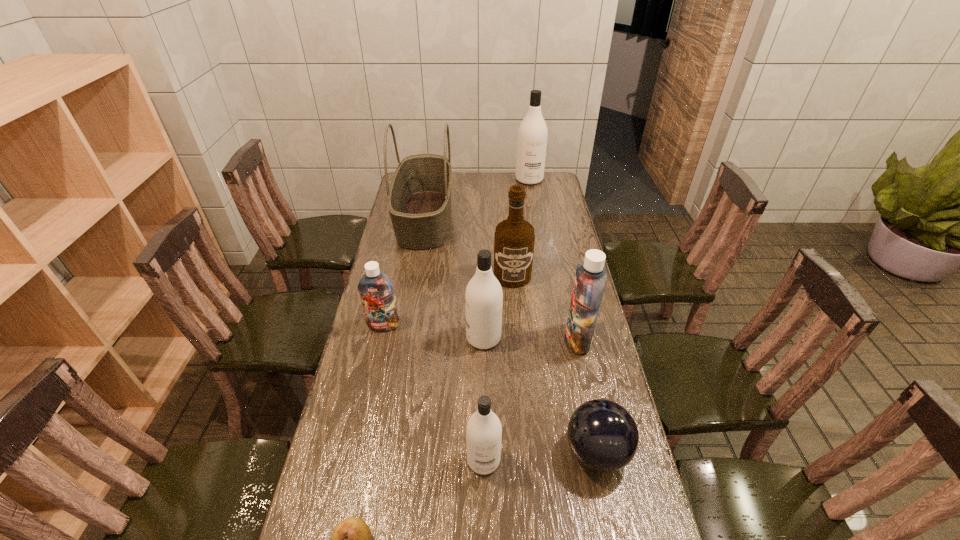
Image resolution: width=960 pixels, height=540 pixels. Identify the location of free space located 0.170m on the front-facing side of the second farthest white shampoo. (416, 338).

Identify the location of vacant space positioned 0.230m on the front-facing side of the second farthest white shampoo. (397, 338).

Identify the location of free location located on the front label of the left blue shampoo. (370, 387).

Identify the location of free space located 0.080m on the front-facing side of the nearest shampoo. The height and width of the screenshot is (540, 960). (484, 509).

This screenshot has height=540, width=960. Identify the location of vacant space located 0.120m on the side of the bowling ball with the finger holes. (519, 452).

At what (x,y) coordinates should I click in order to perform the action: click on blank area located 0.280m on the side of the bowling ball with the finger holes. Please return your answer as a coordinate pair (x, y). The width and height of the screenshot is (960, 540). Looking at the image, I should click on (460, 452).

This screenshot has width=960, height=540. Find the location of `vacant space situated on the side of the bowling ball with the finger holes`. vacant space situated on the side of the bowling ball with the finger holes is located at coordinates (516, 452).

This screenshot has height=540, width=960. I want to click on shampoo that is at the far edge, so click(x=532, y=135).

This screenshot has width=960, height=540. What are the coordinates of `basket located at the far edge` in the screenshot? It's located at (419, 200).

Locate an element on the screen. basket that is at the left edge is located at coordinates (419, 200).